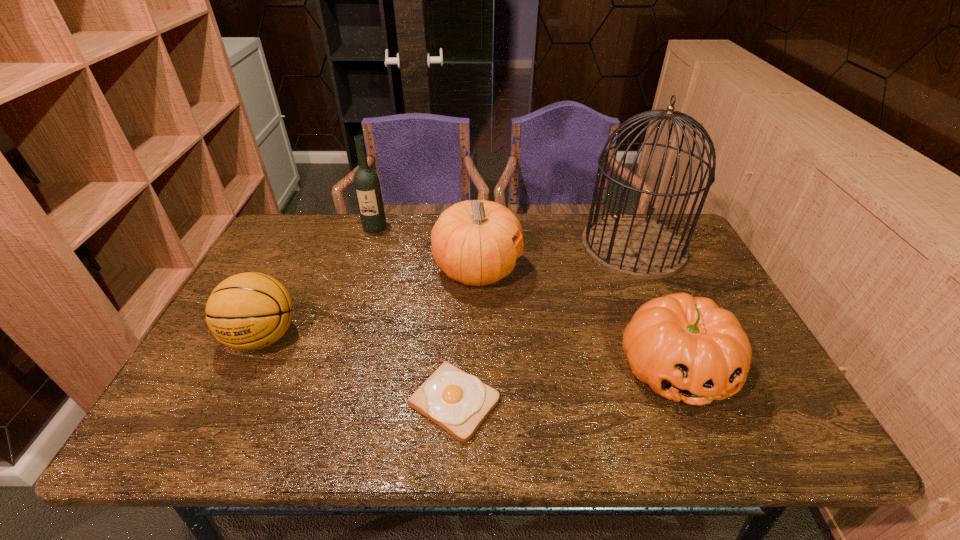
Identify the location of vacant position at the near right corner of the desktop. (743, 420).

Find the location of a particular element. The height and width of the screenshot is (540, 960). free spot between the toast and the wine bottle is located at coordinates (415, 315).

Where is `vacant area that lies between the shorter pumpkin and the toast`? vacant area that lies between the shorter pumpkin and the toast is located at coordinates point(564,384).

Find the location of a particular element. This screenshot has width=960, height=540. empty location between the basketball and the wine bottle is located at coordinates (319, 282).

I want to click on vacant space that's between the toast and the left pumpkin, so click(x=466, y=336).

Locate an element on the screen. vacant area that lies between the leftmost object and the birdcage is located at coordinates (448, 292).

This screenshot has width=960, height=540. I want to click on unoccupied position between the shortest object and the third tallest object, so coord(466,336).

At what (x,y) coordinates should I click in order to perform the action: click on vacant region between the shortest object and the wine bottle. Please return your answer as a coordinate pair (x, y). Looking at the image, I should click on (415, 315).

The height and width of the screenshot is (540, 960). What are the coordinates of `free space between the second object from left to right and the right pumpkin` in the screenshot? It's located at (525, 298).

You are a GUI agent. You are given a task and a screenshot of the screen. Output one action in this format:
    pyautogui.click(x=<x>, y=<y>)
    Task: Click on the empty location between the toast and the tallest object
    Image resolution: width=960 pixels, height=540 pixels.
    Given the screenshot: What is the action you would take?
    pyautogui.click(x=543, y=324)